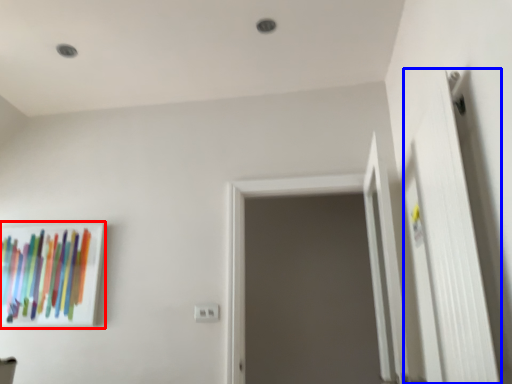
Question: Which object appears farthest to the camera in this image, picture frame (highlighted by a red box) or door (highlighted by a blue box)?

Choices:
 (A) picture frame
 (B) door

Answer: (A)